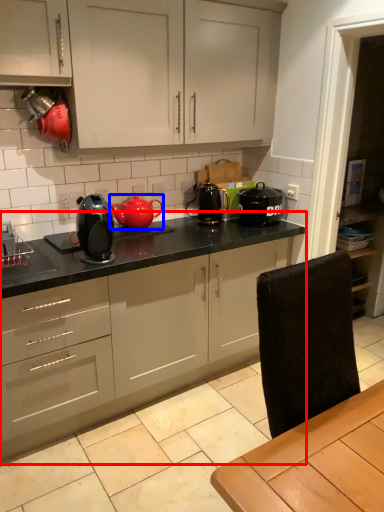
Question: Which object is closer to the camera taking this photo, countertop (highlighted by a red box) or kitchen appliance (highlighted by a blue box)?

Choices:
 (A) countertop
 (B) kitchen appliance

Answer: (A)